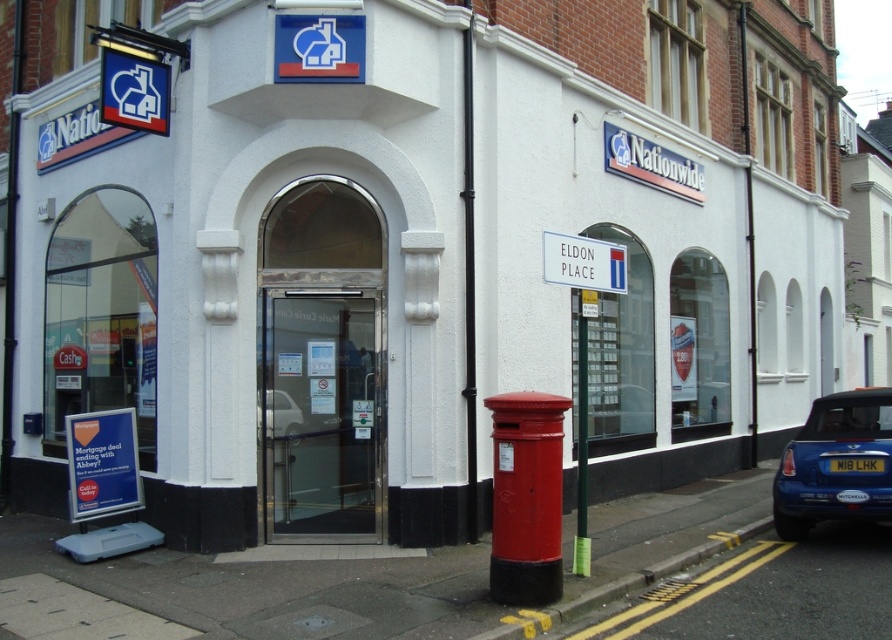
Question: Among these points, which one is farthest from the camera?

Choices:
 (A) (577, 308)
 (B) (855, 458)

Answer: (A)

Question: Where is transparent glass door at center located in relation to black metal pole at center in the image?

Choices:
 (A) above
 (B) below

Answer: (B)

Question: Which point is farther from the camera taking this photo?

Choices:
 (A) (464, 122)
 (B) (832, 461)
 (C) (261, 332)
 (D) (585, 552)

Answer: (A)

Question: Which object appears closest to the camera in this image?

Choices:
 (A) black metal pole at center
 (B) metallic green pole at center
 (C) blue metallic car at lower right

Answer: (B)

Question: Is transparent glass door at center thinner than blue metallic car at lower right?

Choices:
 (A) yes
 (B) no

Answer: (B)

Question: Can you confirm if transparent glass door at center is wider than metallic green pole at center?

Choices:
 (A) yes
 (B) no

Answer: (A)